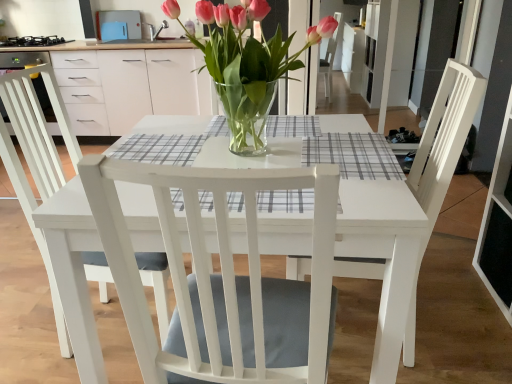
This screenshot has height=384, width=512. I want to click on vacant area on top of white wood chair at center, the 1th chair viewed from the left (from a real-world perspective), so click(280, 139).